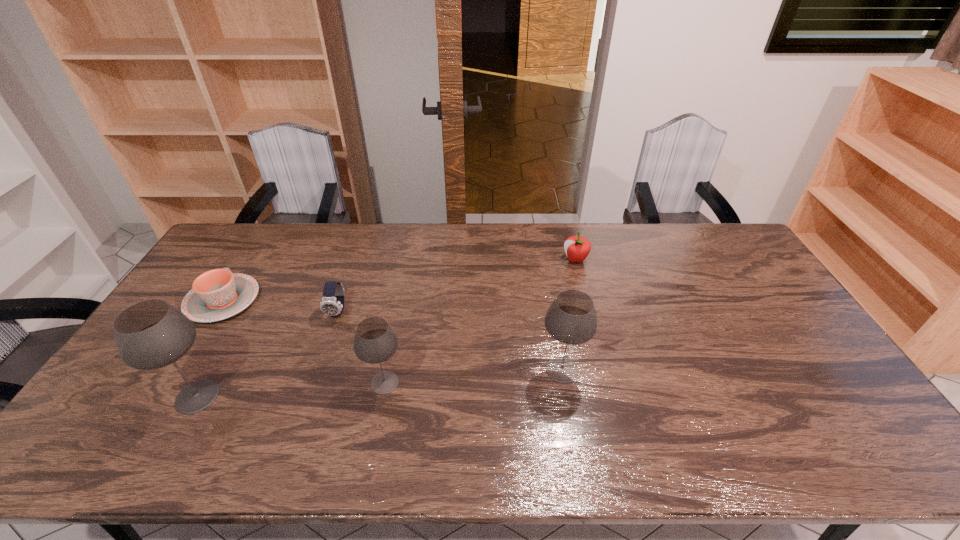
The image size is (960, 540). In order to click on the leftmost wineglass in this screenshot , I will do `click(151, 334)`.

Find the location of a particular element. the fourth shortest object is located at coordinates (375, 341).

The width and height of the screenshot is (960, 540). I want to click on the shortest wineglass, so click(375, 341).

I want to click on the second shortest wineglass, so click(571, 319).

At what (x,y) coordinates should I click in order to perform the action: click on the second tallest object. Please return your answer as a coordinate pair (x, y). This screenshot has width=960, height=540. Looking at the image, I should click on (571, 319).

Locate an element on the screen. The image size is (960, 540). the farthest object is located at coordinates (577, 248).

Find the location of a particular element. This screenshot has height=540, width=960. the rightmost object is located at coordinates (577, 248).

Locate an element on the screen. watch is located at coordinates (332, 303).

The width and height of the screenshot is (960, 540). I want to click on chinaware, so click(218, 294).

Locate an element on the screen. The image size is (960, 540). free space located 0.220m on the right of the leftmost wineglass is located at coordinates (312, 396).